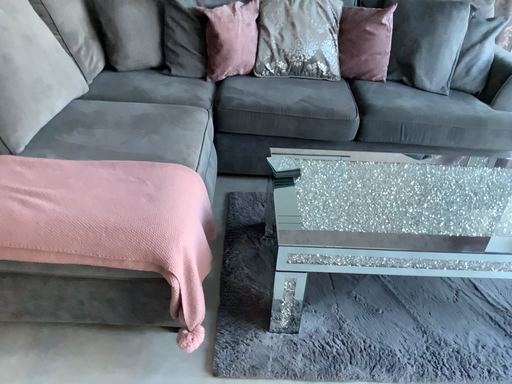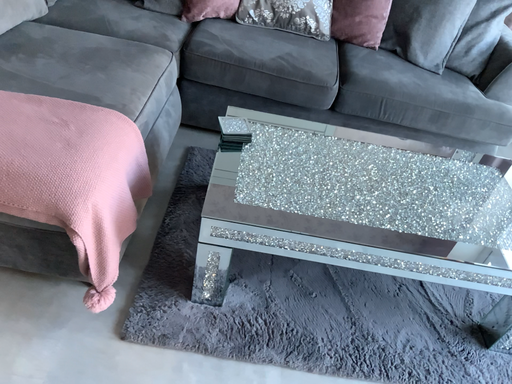
Question: Which way did the camera rotate in the video?

Choices:
 (A) rotated downward
 (B) rotated upward

Answer: (A)